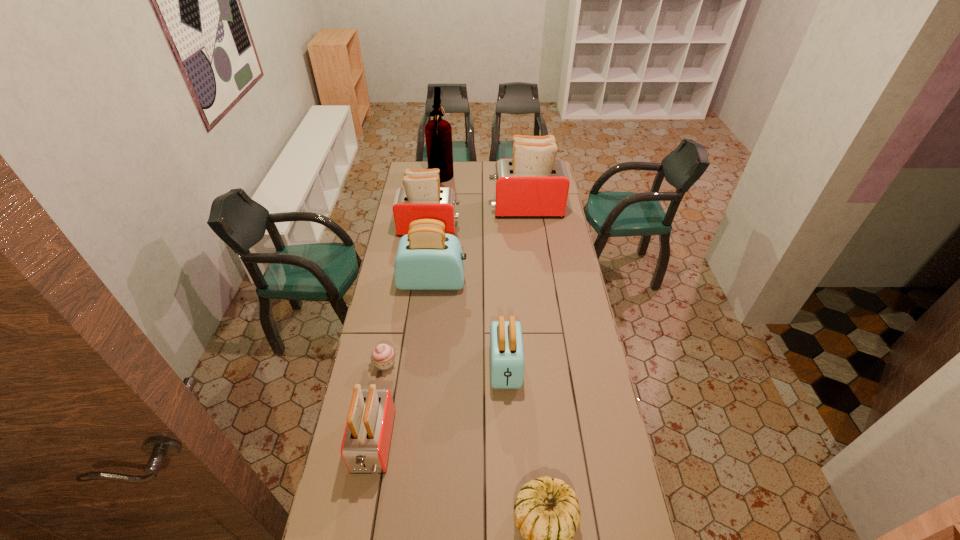
I want to click on free region located on the front-facing side of the nearest toaster, so click(x=363, y=504).

The image size is (960, 540). I want to click on free space located 0.240m on the back of the shortest object, so click(x=396, y=308).

Find the location of a particular element. object present at the far edge is located at coordinates (438, 133).

Image resolution: width=960 pixels, height=540 pixels. What are the coordinates of `fire extinguisher situated at the left edge` in the screenshot? It's located at (438, 133).

At what (x,y) coordinates should I click in order to perform the action: click on cupcake present at the left edge. Please return your answer as a coordinate pair (x, y). The width and height of the screenshot is (960, 540). Looking at the image, I should click on (383, 355).

The height and width of the screenshot is (540, 960). What are the coordinates of `object located in the right edge section of the desktop` in the screenshot? It's located at (533, 184).

The width and height of the screenshot is (960, 540). I want to click on object that is at the far left corner, so click(x=438, y=133).

What are the coordinates of `blank space at the far edge of the desktop` in the screenshot? It's located at (486, 162).

The image size is (960, 540). What are the coordinates of `vacant point at the left edge` in the screenshot? It's located at click(388, 274).

Find the location of a particular element. The image size is (960, 540). free space at the right edge is located at coordinates (566, 418).